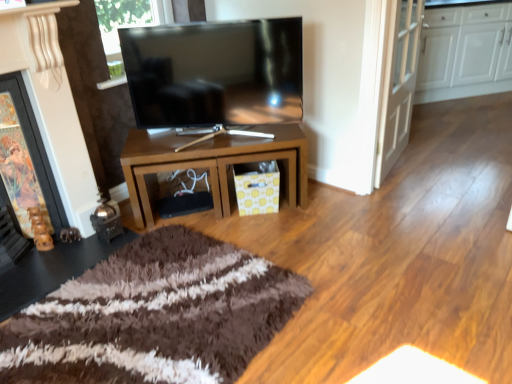
This screenshot has width=512, height=384. What are the coordinates of `free point below matte black tv at center (from a real-world perspective)` in the screenshot? It's located at (195, 142).